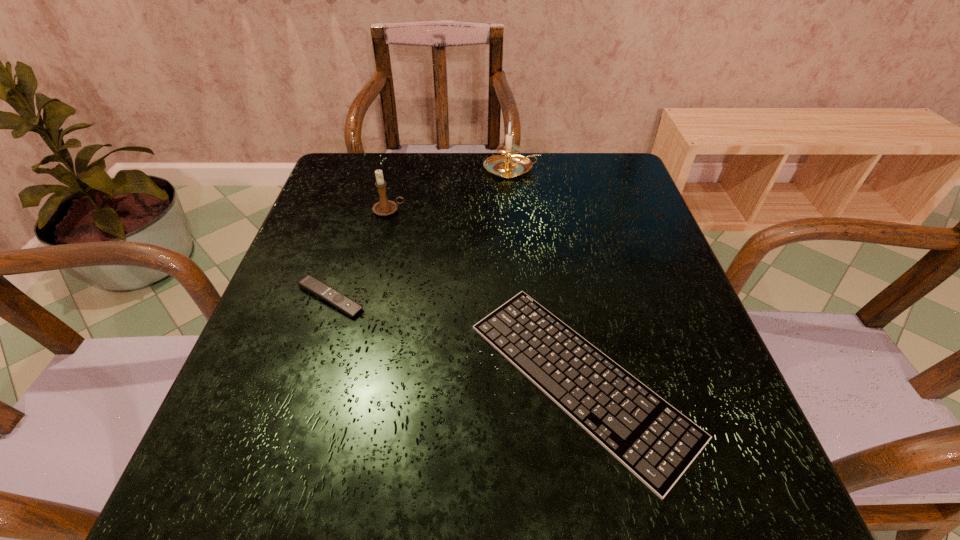
Locate an element on the screen. This screenshot has width=960, height=540. object that is at the far edge is located at coordinates (509, 166).

Locate an element on the screen. Image resolution: width=960 pixels, height=540 pixels. object present at the near edge is located at coordinates (652, 439).

At what (x,y) coordinates should I click in order to perform the action: click on candle holder that is positioned at the left edge. Please return your answer as a coordinate pair (x, y). The image size is (960, 540). Looking at the image, I should click on (384, 207).

Find the location of a particular element. remote control positioned at the left edge is located at coordinates (309, 283).

I want to click on object that is at the right edge, so click(x=652, y=439).

The height and width of the screenshot is (540, 960). Find the location of `object at the near right corner`. object at the near right corner is located at coordinates (652, 439).

The width and height of the screenshot is (960, 540). Find the location of `free space at the far edge of the desktop`. free space at the far edge of the desktop is located at coordinates (534, 183).

Locate an element on the screen. Image resolution: width=960 pixels, height=540 pixels. free space at the near edge of the desktop is located at coordinates (339, 481).

Identify the location of vacant space at the left edge of the desktop. (332, 379).

The image size is (960, 540). In the image, there is a desktop. Find the location of `blank space at the right edge`. blank space at the right edge is located at coordinates (656, 228).